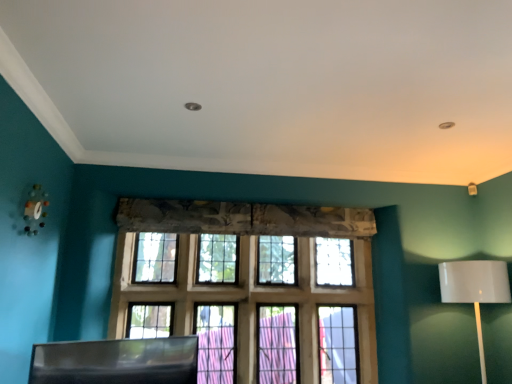
Question: From the image's perspective, is white glossy table lamp at right positioned above or below black plastic swivel chair at lower left?

Choices:
 (A) above
 (B) below

Answer: (A)

Question: Considering the positions of white glossy table lamp at right and black plastic swivel chair at lower left in the image, is white glossy table lamp at right taller or shorter than black plastic swivel chair at lower left?

Choices:
 (A) tall
 (B) short

Answer: (A)

Question: Based on their relative distances, which object is nearer to the wooden grid window at center?

Choices:
 (A) black plastic swivel chair at lower left
 (B) white glossy table lamp at right

Answer: (A)

Question: Considering the real-world distances, which object is farthest from the wooden grid window at center?

Choices:
 (A) black plastic swivel chair at lower left
 (B) white glossy table lamp at right

Answer: (B)